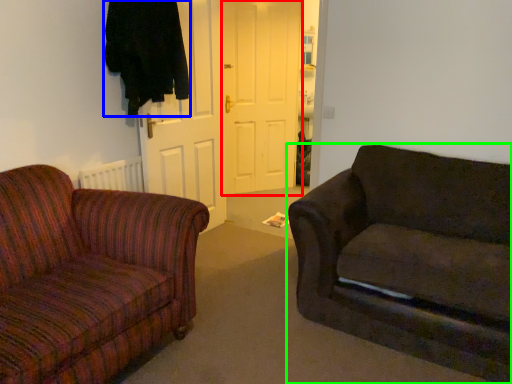
Question: Which object is positioned farthest from door (highlighted by a red box)? Select from clothing (highlighted by a blue box) and studio couch (highlighted by a green box).

Choices:
 (A) clothing
 (B) studio couch

Answer: (B)